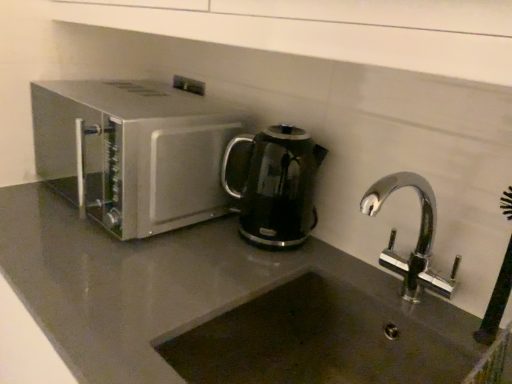
Question: Would you say dark gray stone sink at lower center is to the left or to the right of satin silver microwave at left in the picture?

Choices:
 (A) left
 (B) right

Answer: (B)

Question: Based on their sizes in the image, would you say dark gray stone sink at lower center is bigger or smaller than satin silver microwave at left?

Choices:
 (A) small
 (B) big

Answer: (A)

Question: Estimate the real-world distances between objects in this image. Which object is farther from the dark gray stone sink at lower center?

Choices:
 (A) satin silver microwave at left
 (B) black glossy electric kettle at center

Answer: (A)

Question: Which is nearer to the satin silver microwave at left?

Choices:
 (A) dark gray stone sink at lower center
 (B) black glossy electric kettle at center

Answer: (B)